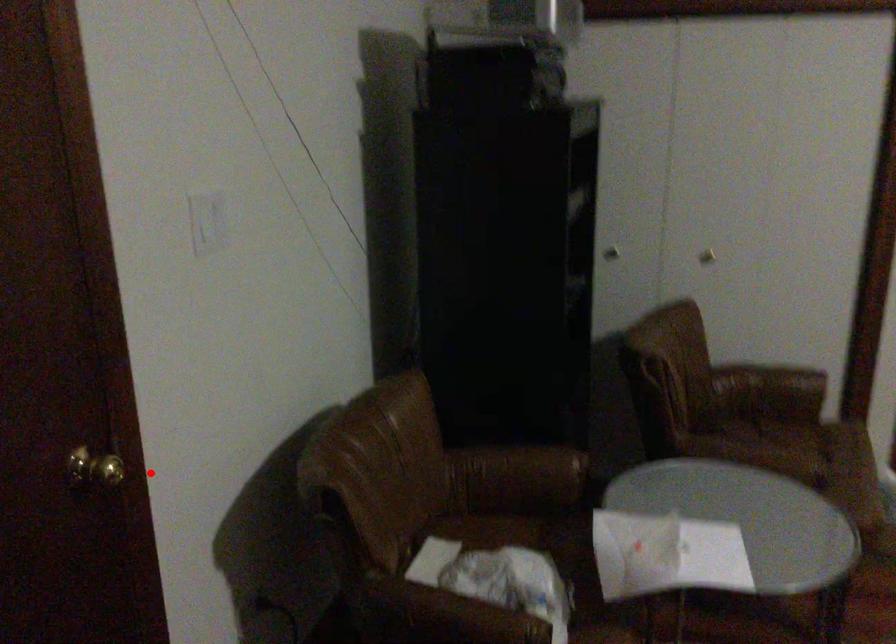
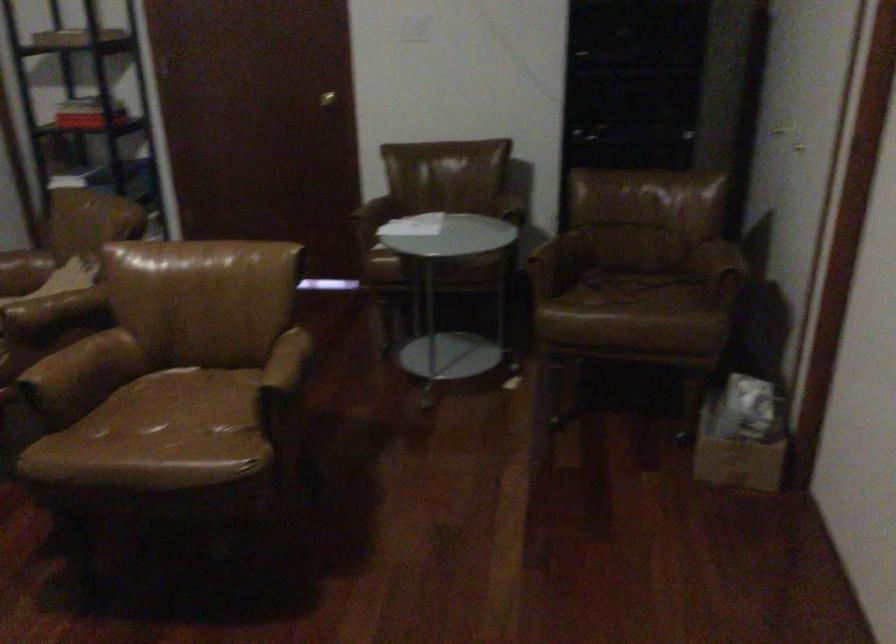
Question: A red point is marked in image1. In image2, is the corresponding 3D point closer to the camera or farther? Reply with the corresponding letter.

Choices:
 (A) The corresponding 3D point is closer.
 (B) The corresponding 3D point is farther.

Answer: (B)